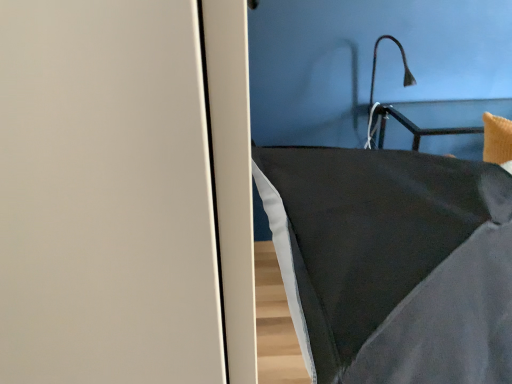
Question: From a real-world perspective, is dark gray fabric pillow at center physically located above or below black matte lamp at upper right?

Choices:
 (A) below
 (B) above

Answer: (A)

Question: Looking at the image, does dark gray fabric pillow at center seem bigger or smaller compared to black matte lamp at upper right?

Choices:
 (A) big
 (B) small

Answer: (A)

Question: Considering the positions of dark gray fabric pillow at center and black matte lamp at upper right in the image, is dark gray fabric pillow at center taller or shorter than black matte lamp at upper right?

Choices:
 (A) short
 (B) tall

Answer: (B)

Question: Is black matte lamp at upper right bigger or smaller than dark gray fabric pillow at center?

Choices:
 (A) small
 (B) big

Answer: (A)

Question: Is black matte lamp at upper right to the left or to the right of dark gray fabric pillow at center in the image?

Choices:
 (A) left
 (B) right

Answer: (B)

Question: Looking at their shapes, would you say black matte lamp at upper right is wider or thinner than dark gray fabric pillow at center?

Choices:
 (A) thin
 (B) wide

Answer: (A)

Question: From their relative heights in the image, would you say black matte lamp at upper right is taller or shorter than dark gray fabric pillow at center?

Choices:
 (A) short
 (B) tall

Answer: (A)